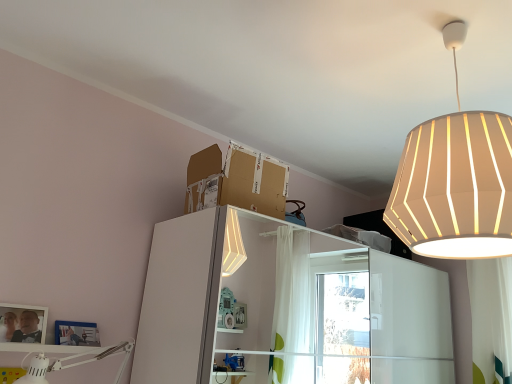
Question: From the image's perspective, is white fabric lampshade at upper right, the second lamp viewed from the left, beneath matte silver picture frame at lower left?

Choices:
 (A) no
 (B) yes

Answer: (A)

Question: Could matte silver picture frame at lower left be considered to be inside white fabric lampshade at upper right, the second lamp viewed from the left?

Choices:
 (A) yes
 (B) no

Answer: (B)

Question: From a real-world perspective, is white fabric lampshade at upper right, placed as the 1th lamp when sorted from right to left, physically below matte silver picture frame at lower left?

Choices:
 (A) yes
 (B) no

Answer: (B)

Question: Is white fabric lampshade at upper right, placed as the 1th lamp when sorted from right to left, to the left of matte silver picture frame at lower left from the viewer's perspective?

Choices:
 (A) yes
 (B) no

Answer: (B)

Question: Are white fabric lampshade at upper right, placed as the 1th lamp when sorted from right to left, and matte silver picture frame at lower left located far from each other?

Choices:
 (A) no
 (B) yes

Answer: (B)

Question: In the image, is white fabric lampshade at upper right, positioned as the first lamp in top-to-bottom order, on the left side or the right side of matte silver picture frame at lower left?

Choices:
 (A) left
 (B) right

Answer: (B)

Question: Choose the correct answer: Is white fabric lampshade at upper right, placed as the 1th lamp when sorted from right to left, inside matte silver picture frame at lower left or outside it?

Choices:
 (A) outside
 (B) inside

Answer: (A)

Question: Considering the positions of white fabric lampshade at upper right, placed as the second lamp when sorted from bottom to top, and matte silver picture frame at lower left in the image, is white fabric lampshade at upper right, placed as the second lamp when sorted from bottom to top, taller or shorter than matte silver picture frame at lower left?

Choices:
 (A) tall
 (B) short

Answer: (A)

Question: From the image's perspective, is white fabric lampshade at upper right, placed as the second lamp when sorted from bottom to top, positioned above or below matte silver picture frame at lower left?

Choices:
 (A) above
 (B) below

Answer: (A)

Question: From a real-world perspective, is white glossy bookshelf at upper center physically located above or below white matte desk lamp at lower left, which is counted as the second lamp, starting from the right?

Choices:
 (A) above
 (B) below

Answer: (A)

Question: From the image's perspective, is white glossy bookshelf at upper center located above or below white matte desk lamp at lower left, arranged as the 1th lamp when viewed from the left?

Choices:
 (A) below
 (B) above

Answer: (A)

Question: Is white glossy bookshelf at upper center situated inside white matte desk lamp at lower left, arranged as the 1th lamp when viewed from the left, or outside?

Choices:
 (A) inside
 (B) outside

Answer: (B)

Question: In the image, is white glossy bookshelf at upper center positioned in front of or behind white matte desk lamp at lower left, which is counted as the second lamp, starting from the right?

Choices:
 (A) behind
 (B) front

Answer: (A)

Question: From a real-world perspective, relative to brown cardboard box at upper center, is white glossy bookshelf at upper center vertically above or below?

Choices:
 (A) below
 (B) above

Answer: (A)

Question: Relative to brown cardboard box at upper center, is white glossy bookshelf at upper center in front or behind?

Choices:
 (A) behind
 (B) front

Answer: (B)